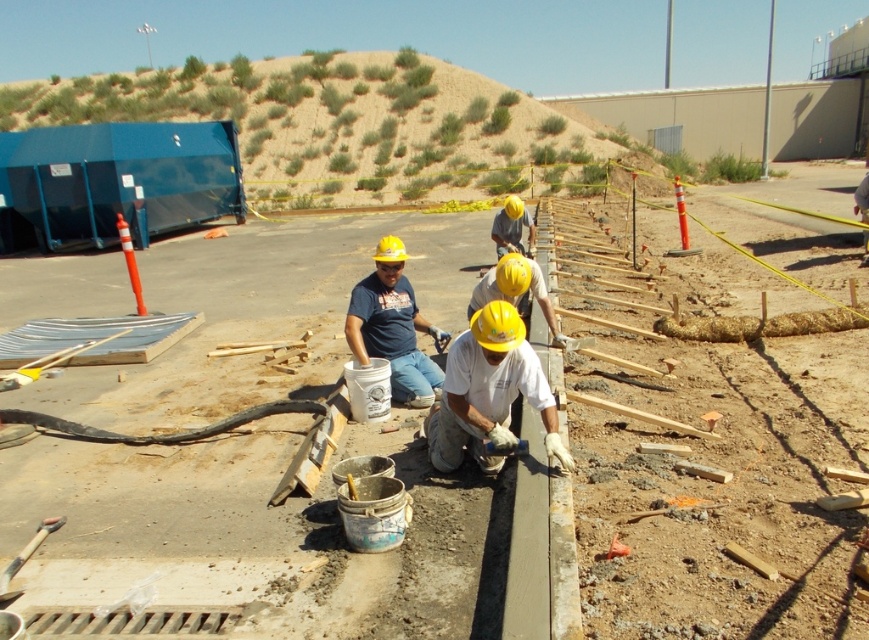
Does white matte hard hat at center lie in front of matte yellow hard hat at center?

Yes, it is in front of matte yellow hard hat at center.

Who is more forward, (508, 324) or (383, 278)?

Point (508, 324) is more forward.

Image resolution: width=869 pixels, height=640 pixels. In order to click on white matte hard hat at center in this screenshot , I will do `click(489, 392)`.